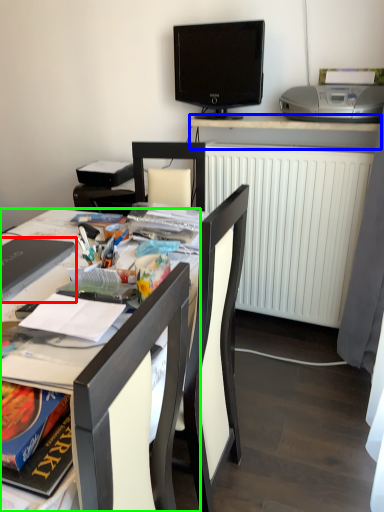
Question: Based on their relative distances, which object is nearer to laptop (highlighted by a red box)? Choose from desk (highlighted by a blue box) and desk (highlighted by a green box).

Choices:
 (A) desk
 (B) desk

Answer: (B)